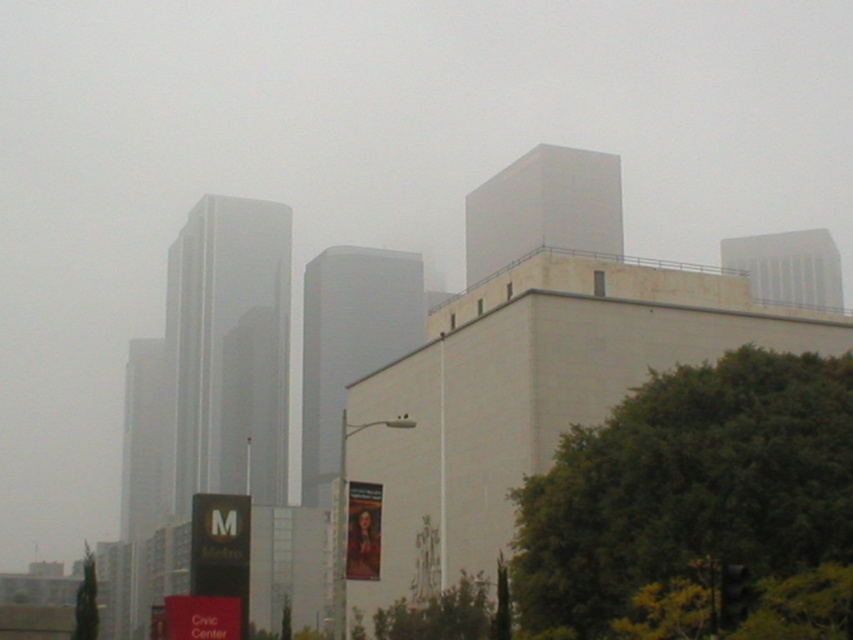
Is green leafy tree at lower right shorter than green leafy tree at lower left?

Yes.

Does green leafy tree at lower right come behind green leafy tree at lower left?

Yes, green leafy tree at lower right is behind green leafy tree at lower left.

At what (x,y) coordinates should I click in order to perform the action: click on green leafy tree at lower right. Please return your answer as a coordinate pair (x, y). This screenshot has width=853, height=640. Looking at the image, I should click on (689, 484).

I want to click on green leafy tree at lower right, so [x=689, y=484].

Locate an element on the screen. green leafy tree at lower right is located at coordinates (689, 484).

What are the coordinates of `green leafy tree at lower right` in the screenshot? It's located at (689, 484).

Between point (91, 572) and point (734, 620), which one is positioned behind?

Positioned behind is point (91, 572).

Is the position of green leafy tree at lower left less distant than that of black matte traffic light at lower right?

No, green leafy tree at lower left is behind black matte traffic light at lower right.

Who is more distant from viewer, (x=94, y=628) or (x=743, y=611)?

Point (x=94, y=628)

Find the location of a particular element. green leafy tree at lower left is located at coordinates (86, 600).